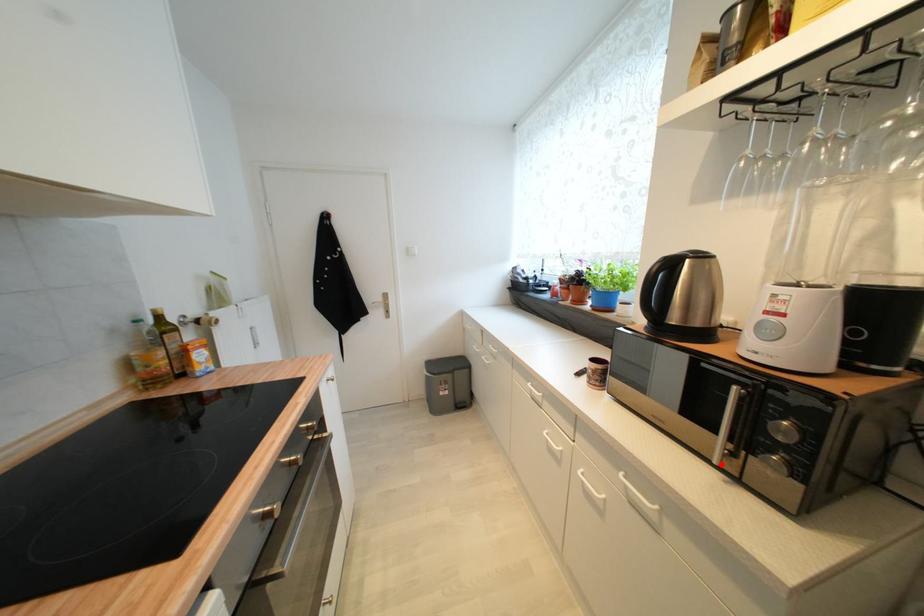
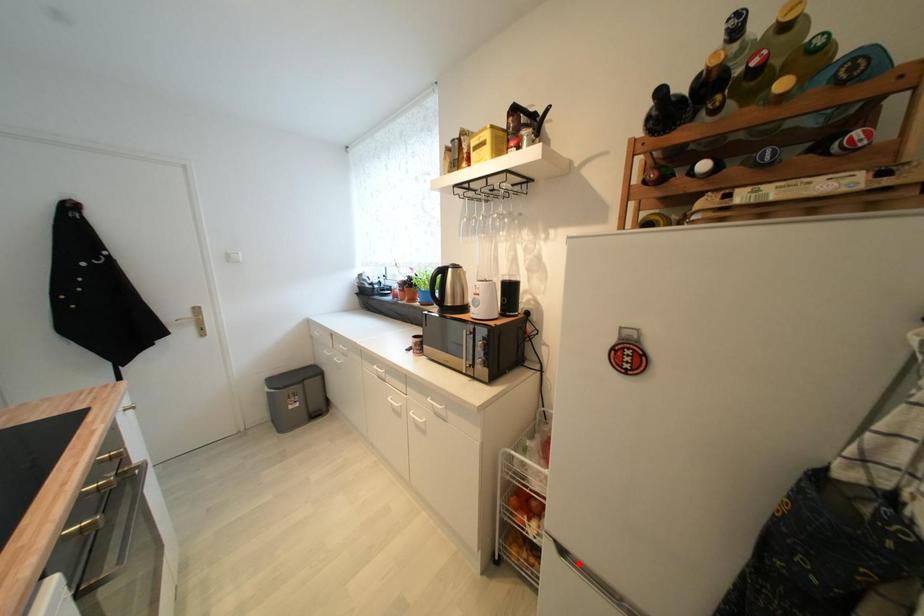
I am providing you with two images of the same scene from different viewpoints. A red point is marked on the first image and another point is marked on the second image. Are the points marked in image1 and image2 representing the same 3D position?

No